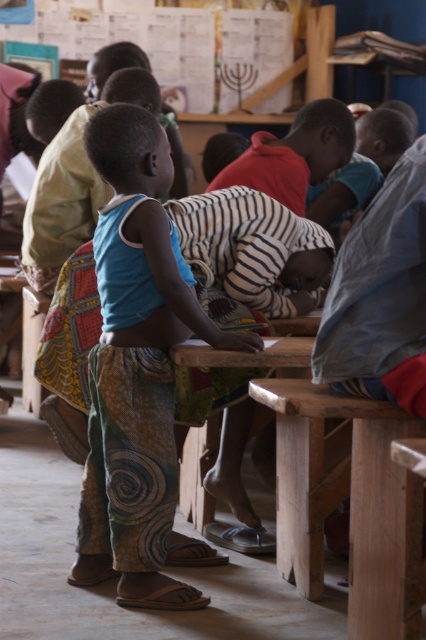
Question: Can you confirm if striped fabric shirt at center is positioned below wooden table at center?

Choices:
 (A) no
 (B) yes

Answer: (A)

Question: Does blue cotton shirt at center lie in front of wooden table at center?

Choices:
 (A) yes
 (B) no

Answer: (A)

Question: Among these points, which one is nearest to the camera?

Choices:
 (A) (183, 353)
 (B) (132, 154)

Answer: (A)

Question: From the image, what is the correct spatial relationship of blue cotton shirt at center in relation to wooden table at center?

Choices:
 (A) above
 (B) below

Answer: (B)

Question: Which of the following is the closest to the observer?

Choices:
 (A) blue cotton shirt at center
 (B) striped fabric shirt at center

Answer: (A)

Question: Which of the following is the closest to the observer?

Choices:
 (A) wooden table at center
 (B) striped fabric shirt at center
 (C) blue cotton shirt at center

Answer: (C)